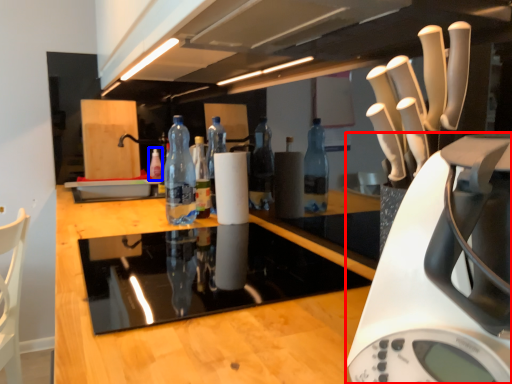
Question: Among these objects, which one is nearest to the camera, home appliance (highlighted by a red box) or bottle (highlighted by a blue box)?

Choices:
 (A) home appliance
 (B) bottle

Answer: (A)